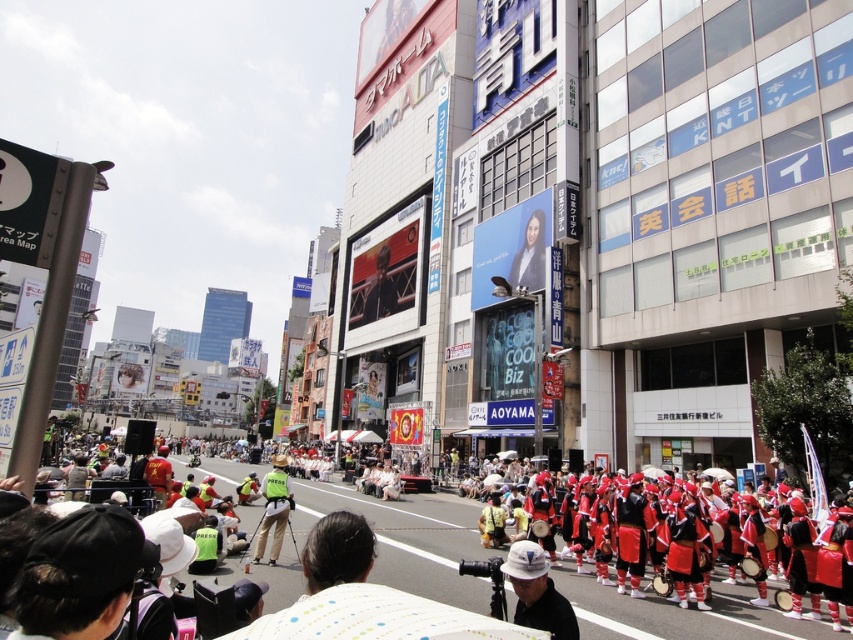
You are standing at the position of the point at coordinates point (296, 508) and want to walk to the point at coordinates point (538, 602). Which direction should you move relative to the camera?

You should move away from the camera because point (296, 508) is closer to the camera than point (538, 602).

You are a photographer standing at the edge of the crowd. You want to take a photo of the red fabric drum at center and the green reflective vest at center. Which object should you focus on first if you want to capture both in one shot without moving the camera?

The red fabric drum at center is shorter than the green reflective vest at center, so you should focus on the red fabric drum at center first to ensure it is in frame before the taller green reflective vest at center might block it.